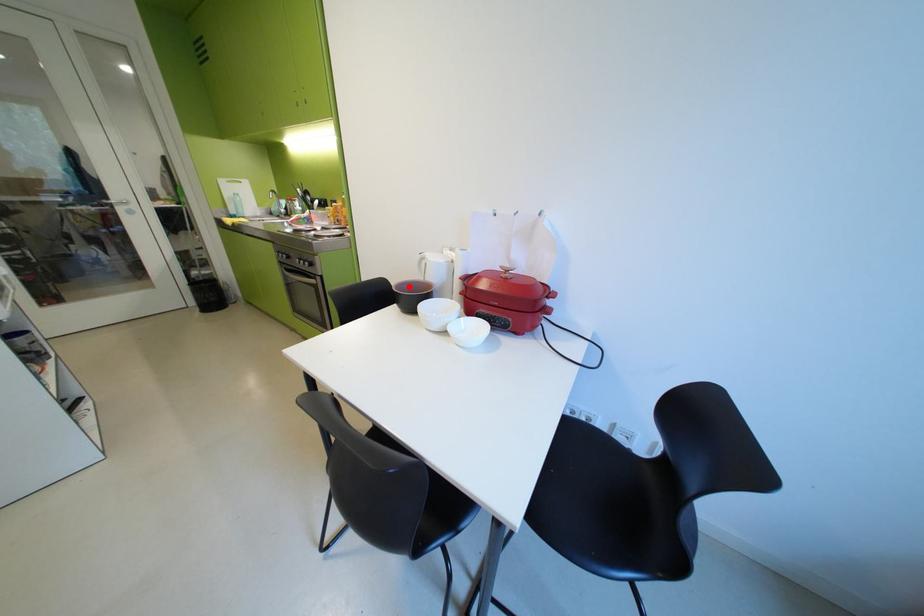
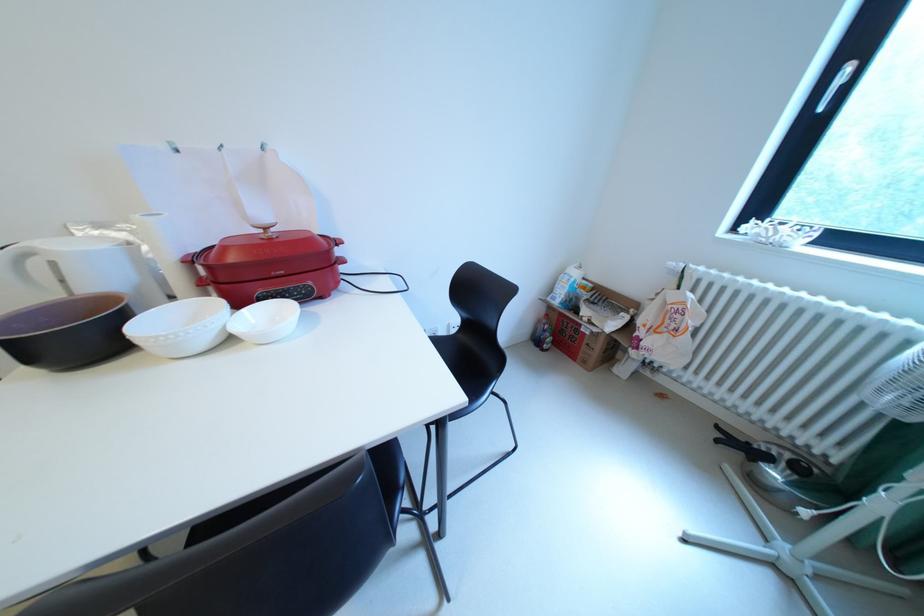
Where in the second image is the point corresponding to the highlighted location from the first image?

(6, 330)